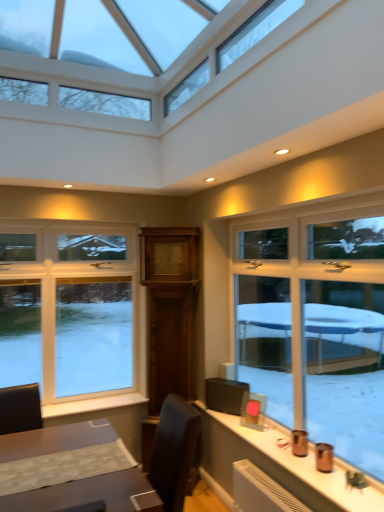
Question: Would you say white painted wood at lower left is a long distance from white plastic window at left?

Choices:
 (A) yes
 (B) no

Answer: (B)

Question: From the image's perspective, is white painted wood at lower left located above white plastic window at left?

Choices:
 (A) no
 (B) yes

Answer: (A)

Question: Is white painted wood at lower left completely or partially outside of white plastic window at left?

Choices:
 (A) no
 (B) yes

Answer: (B)

Question: Can you confirm if white painted wood at lower left is bigger than white plastic window at left?

Choices:
 (A) yes
 (B) no

Answer: (B)

Question: Is white painted wood at lower left positioned behind white plastic window at left?

Choices:
 (A) no
 (B) yes

Answer: (A)

Question: Can you confirm if white painted wood at lower left is taller than white plastic window at left?

Choices:
 (A) no
 (B) yes

Answer: (A)

Question: From a real-world perspective, is white plastic window at left physically below white painted wood at lower left?

Choices:
 (A) no
 (B) yes

Answer: (A)

Question: Considering the relative sizes of white plastic window at left and white painted wood at lower left in the image provided, is white plastic window at left taller than white painted wood at lower left?

Choices:
 (A) yes
 (B) no

Answer: (A)

Question: Is white plastic window at left not inside white painted wood at lower left?

Choices:
 (A) no
 (B) yes

Answer: (B)

Question: Considering the relative positions of white plastic window at left and white painted wood at lower left in the image provided, is white plastic window at left to the left of white painted wood at lower left from the viewer's perspective?

Choices:
 (A) yes
 (B) no

Answer: (A)

Question: Is white plastic window at left looking in the opposite direction of white painted wood at lower left?

Choices:
 (A) no
 (B) yes

Answer: (A)

Question: Can you see white plastic window at left touching white painted wood at lower left?

Choices:
 (A) no
 (B) yes

Answer: (A)

Question: In terms of height, does white painted wood at lower left look taller or shorter compared to white plastic window at left?

Choices:
 (A) tall
 (B) short

Answer: (B)